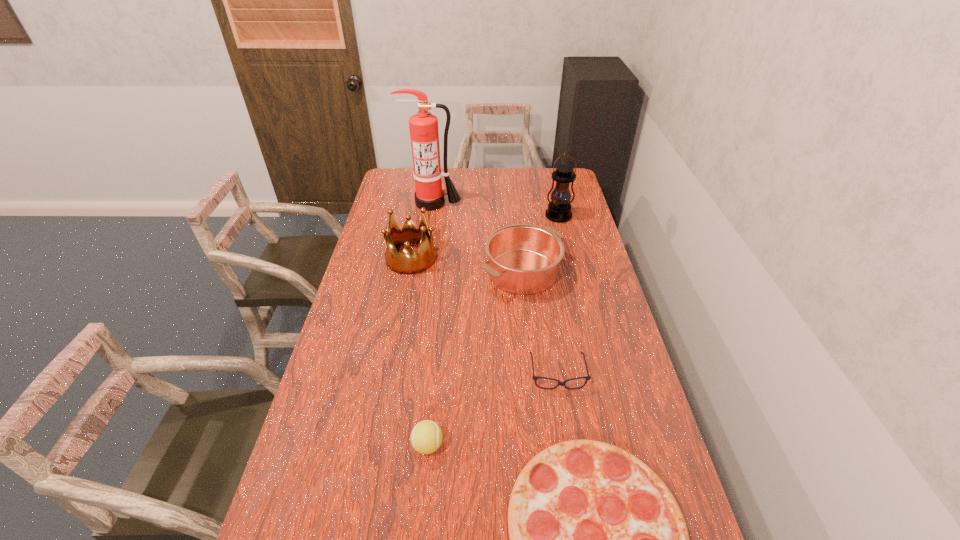
What are the coordinates of `vacant space located 0.050m on the right of the fourth tallest object` in the screenshot? It's located at (x=578, y=272).

What are the coordinates of `vacant space located on the back of the tennis ball` in the screenshot? It's located at (433, 389).

Identify the location of blank space located 0.340m on the front-facing side of the sixth tallest object. Image resolution: width=960 pixels, height=540 pixels. (581, 521).

You are a GUI agent. You are given a task and a screenshot of the screen. Output one action in this format:
    pyautogui.click(x=<x>, y=<y>)
    Task: Click on the fire extinguisher that is positioned at the left edge
    Image resolution: width=960 pixels, height=540 pixels.
    Given the screenshot: What is the action you would take?
    pyautogui.click(x=424, y=134)

Identify the location of crown that is at the left edge. The width and height of the screenshot is (960, 540). (408, 262).

Locate an element on the screen. The image size is (960, 540). lantern situated at the right edge is located at coordinates (559, 209).

Where is `saucepan that is at the right edge`? The height and width of the screenshot is (540, 960). saucepan that is at the right edge is located at coordinates (524, 259).

At what (x,y) coordinates should I click in order to perform the action: click on spectacles positioned at the right edge. Please return your answer as a coordinate pair (x, y). Looking at the image, I should click on (534, 377).

Locate an element on the screen. The width and height of the screenshot is (960, 540). free region at the far edge of the desktop is located at coordinates (494, 172).

Identify the location of free space at the left edge. The width and height of the screenshot is (960, 540). (327, 456).